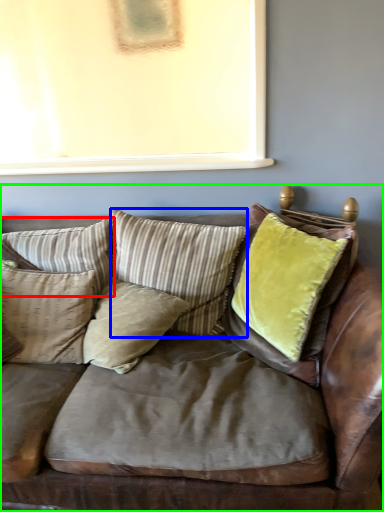
Question: Based on their relative distances, which object is farther from pillow (highlighted by a red box)? Choose from pillow (highlighted by a blue box) and studio couch (highlighted by a green box).

Choices:
 (A) pillow
 (B) studio couch

Answer: (B)